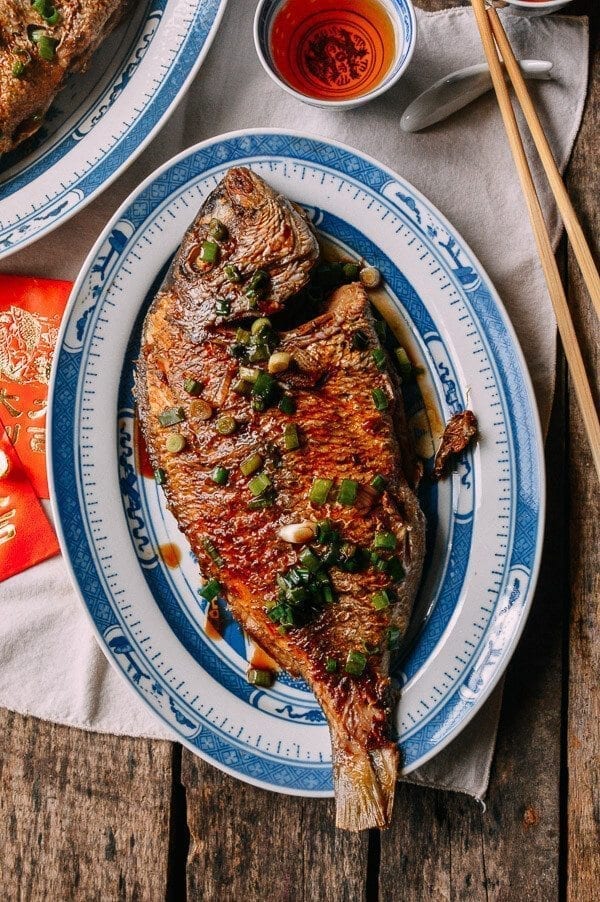
At what (x,y) coordinates should I click in order to perform the action: click on napkin. Please return your answer as a coordinate pair (x, y). The width and height of the screenshot is (600, 902). Looking at the image, I should click on [x=41, y=309], [x=24, y=559].